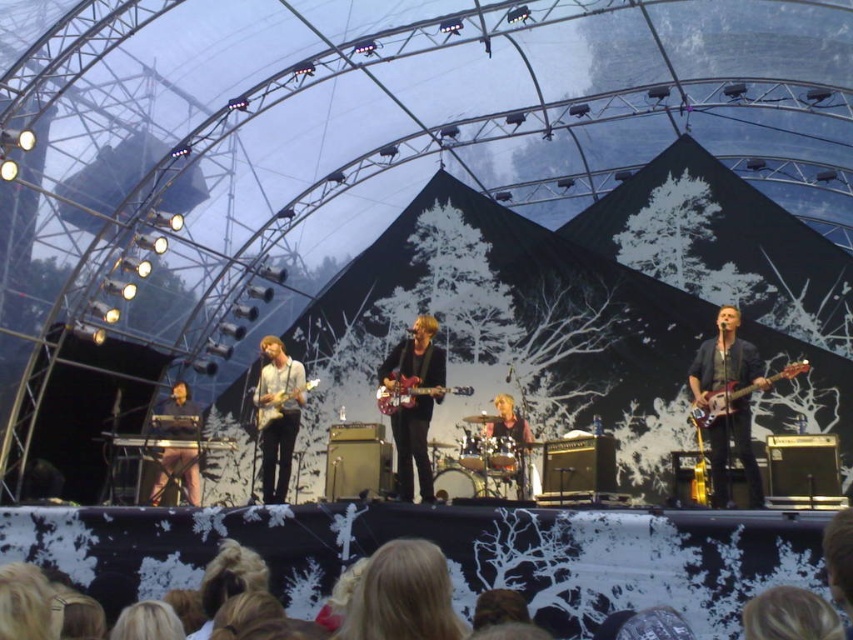
You are a stagehand who needs to place a new microphone stand between the smooth skin drum at center and the glossy wood guitar at center. Which side of the microphone stand should be closer to the smaller instrument?

The smooth skin drum at center is smaller than the glossy wood guitar at center, so the microphone stand should be placed closer to the smooth skin drum at center since it occupies less space.

You are a stagehand who needs to place a new microphone stand between the smooth skin drum at center and the matte wood guitar at center. Which side of the microphone stand should be closer to the thinner instrument to ensure stability?

The smooth skin drum at center is thinner than the matte wood guitar at center, so the microphone stand should be placed closer to the smooth skin drum at center to ensure stability.

What object is located at the coordinates point (511, 435)?

The point (511, 435) corresponds to the smooth skin drum at center.